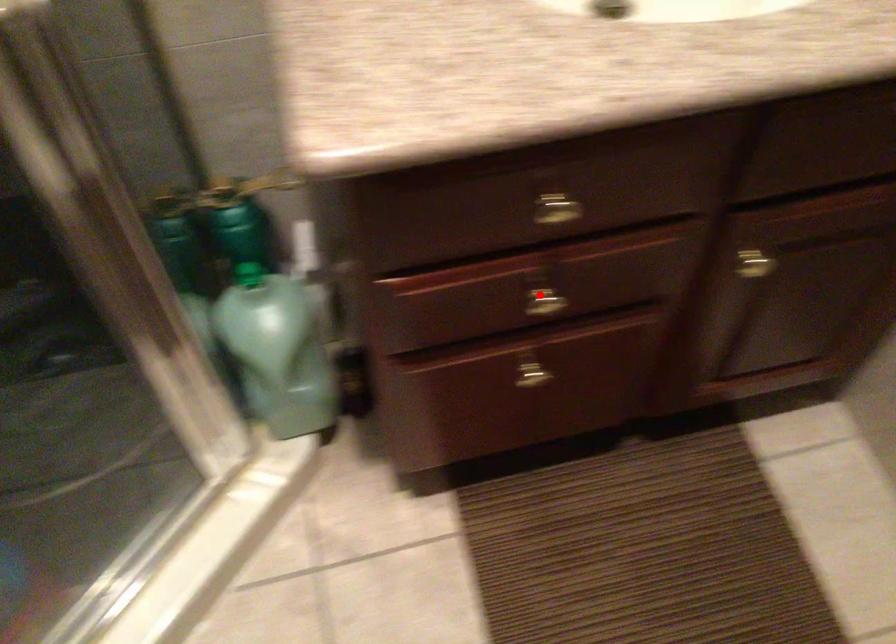
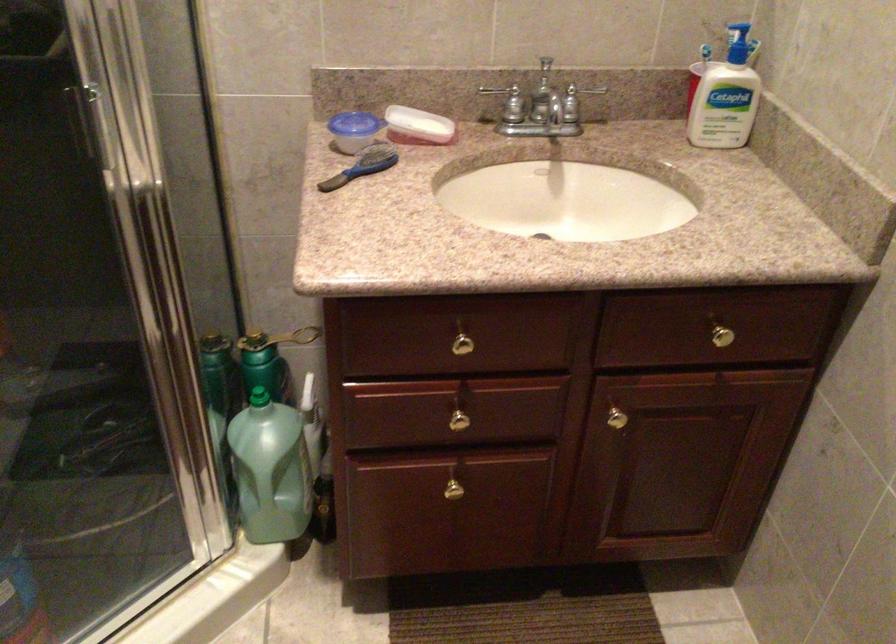
Locate, in the second image, the point that corresponds to the highlighted location in the first image.

(459, 415)